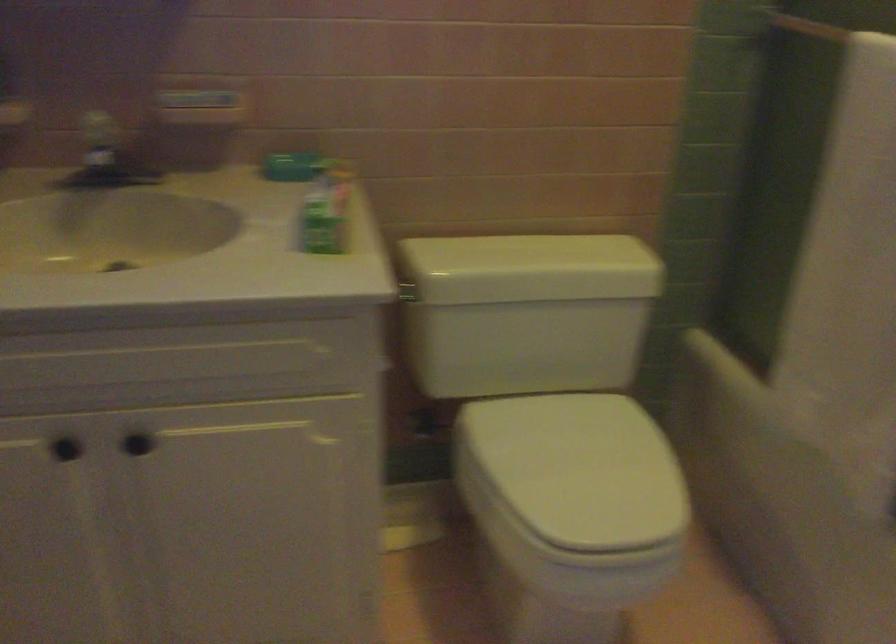
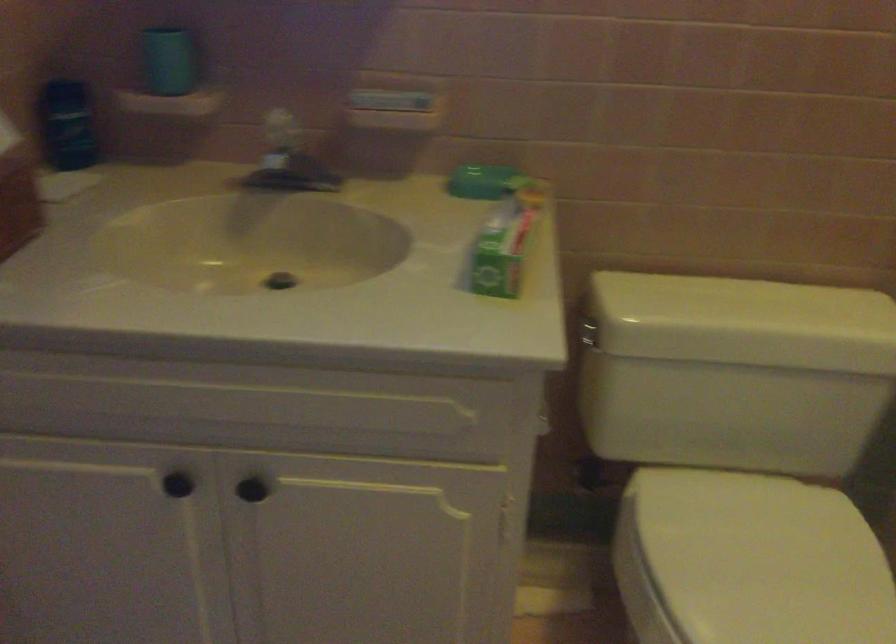
Question: The first image is from the beginning of the video and the second image is from the end. How did the camera likely rotate when shooting the video?

Choices:
 (A) Left
 (B) Right
 (C) Up
 (D) Down

Answer: (A)